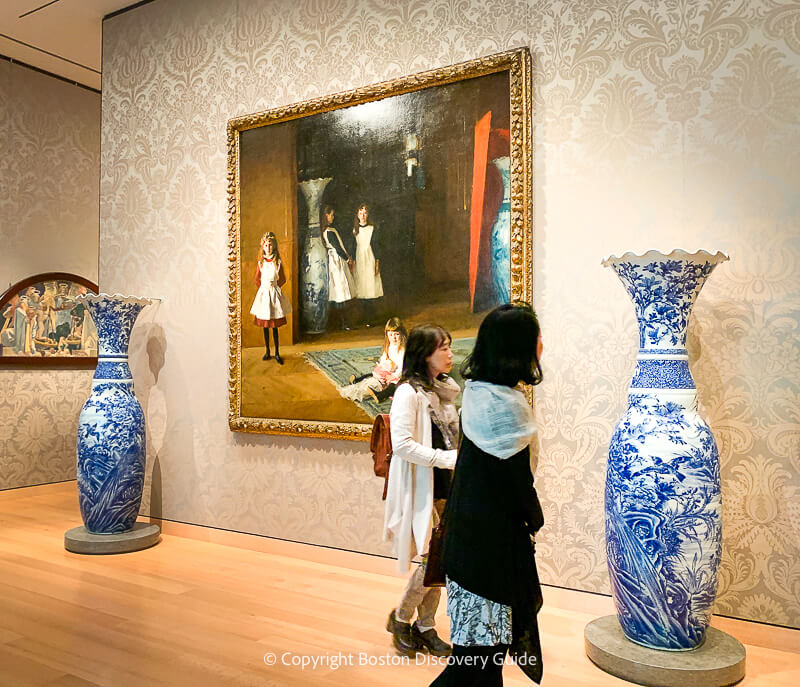
The height and width of the screenshot is (687, 800). In order to click on floor in this screenshot , I will do `click(258, 605)`.